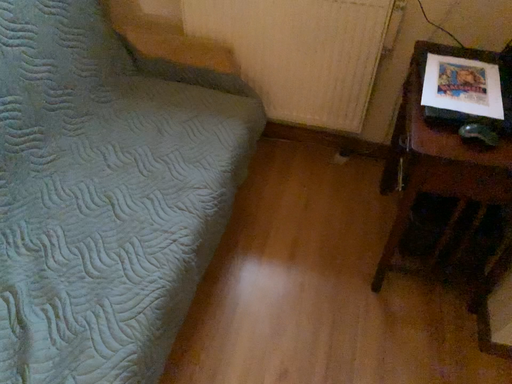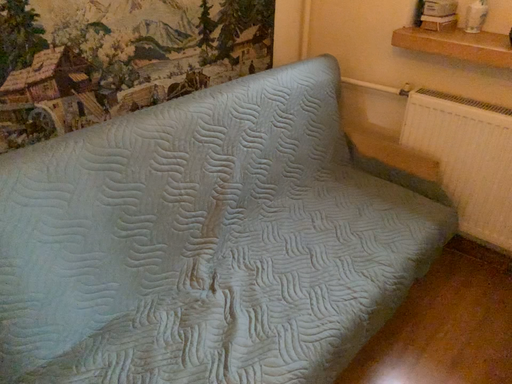
Question: Which way did the camera rotate in the video?

Choices:
 (A) rotated upward
 (B) rotated downward

Answer: (A)